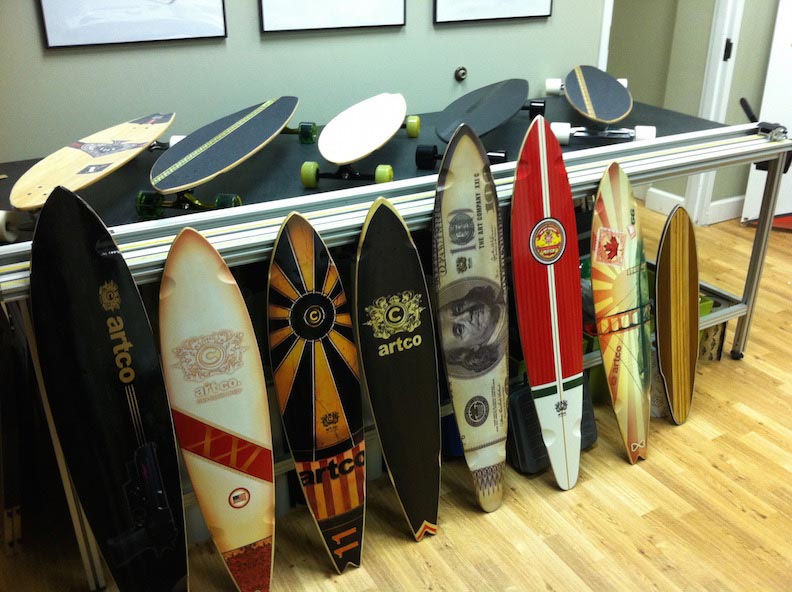
Where is `door jamb`? door jamb is located at coordinates point(726,52).